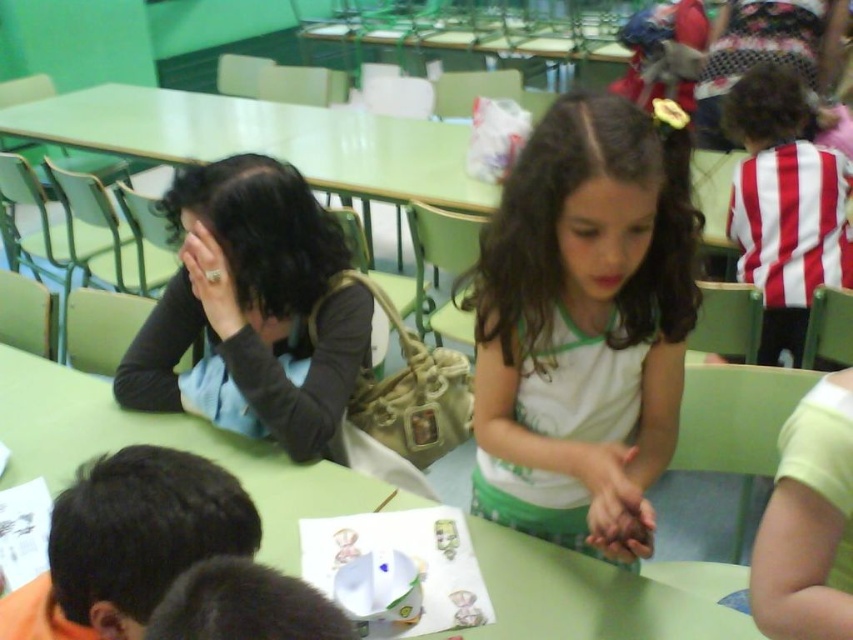
Can you confirm if green matte table at center is wider than black matte shirt at left?

Yes.

Is green matte table at center to the right of black matte shirt at left from the viewer's perspective?

Indeed, green matte table at center is positioned on the right side of black matte shirt at left.

Find the location of `green matte table at center`. green matte table at center is located at coordinates (161, 444).

What do you see at coordinates (161, 444) in the screenshot?
I see `green matte table at center` at bounding box center [161, 444].

Does point (71, 388) lie behind point (39, 625)?

Yes, it is.

Image resolution: width=853 pixels, height=640 pixels. I want to click on green matte table at center, so click(x=161, y=444).

Between black matte shirt at left and dark brown hair at lower left, which one appears on the left side from the viewer's perspective?

From the viewer's perspective, black matte shirt at left appears more on the left side.

Between point (196, 164) and point (152, 497), which one is positioned behind?

Point (196, 164)

The width and height of the screenshot is (853, 640). In order to click on black matte shirt at left in this screenshot , I will do `click(254, 301)`.